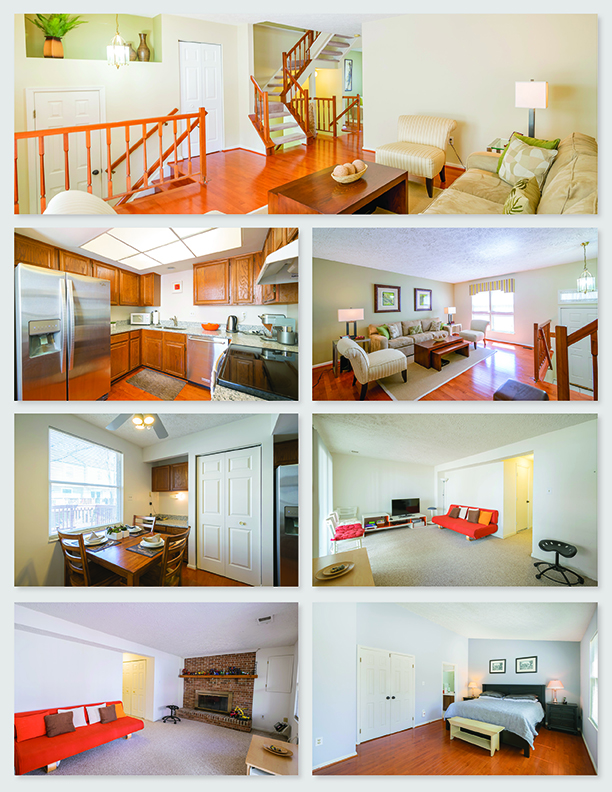
What are the coordinates of `door` in the screenshot? It's located at (198, 80), (48, 111), (230, 537), (377, 701), (403, 691), (139, 695), (125, 691), (285, 672), (524, 499).